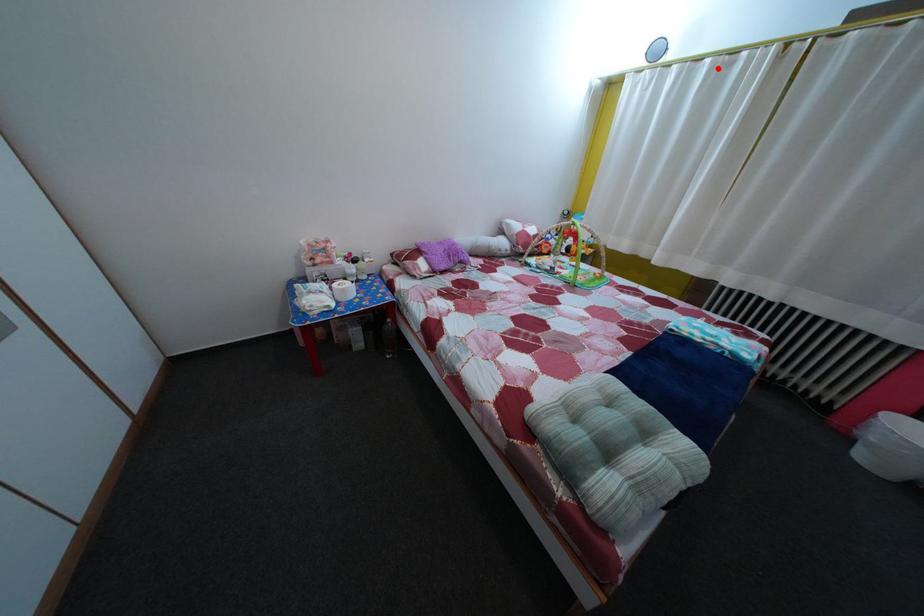
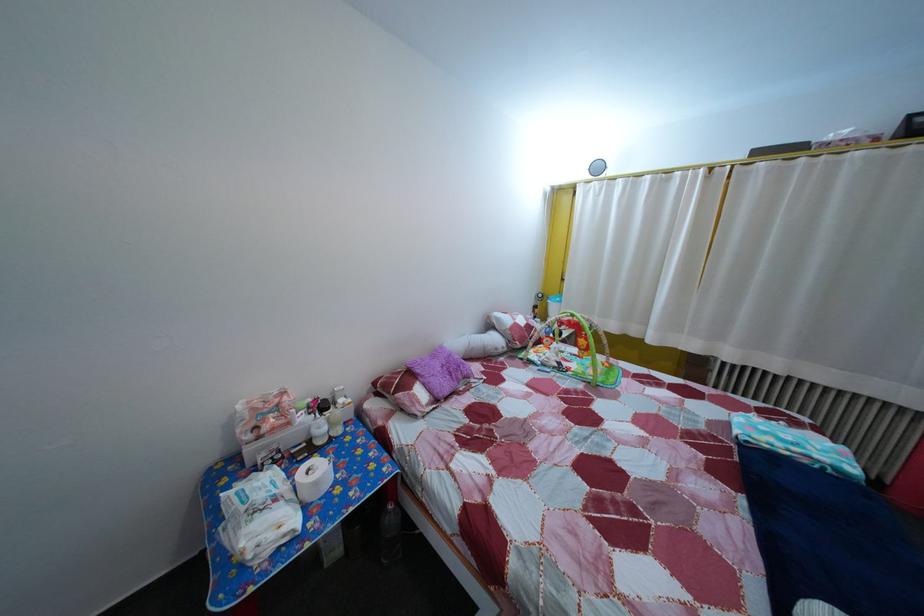
The point at the highlighted location is marked in the first image. Where is the corresponding point in the second image?

(659, 185)